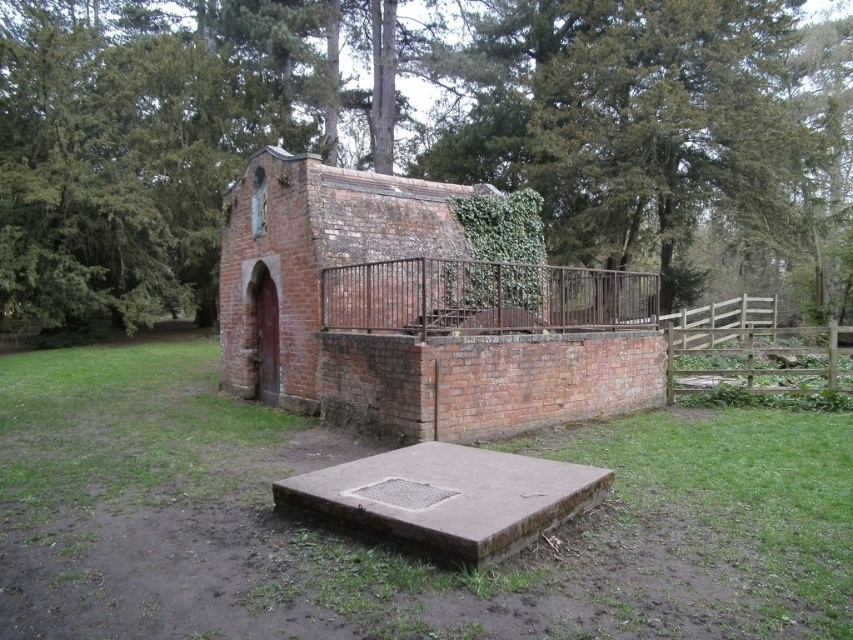
Can you confirm if green leafy tree at upper center is positioned above wooden gate at right?

Correct, green leafy tree at upper center is located above wooden gate at right.

Who is shorter, green leafy tree at upper center or wooden gate at right?

wooden gate at right

This screenshot has height=640, width=853. Identify the location of green leafy tree at upper center. (418, 134).

Can you confirm if brick chapel at center is wider than wooden gate at right?

Incorrect, brick chapel at center's width does not surpass wooden gate at right's.

Looking at this image, who is positioned more to the right, brick chapel at center or wooden gate at right?

wooden gate at right is more to the right.

Is point (306, 177) closer to camera compared to point (703, 323)?

Yes, point (306, 177) is closer to viewer.

Where is `brick chapel at center`? This screenshot has width=853, height=640. brick chapel at center is located at coordinates (416, 310).

Is the position of rusty metal fence at center less distant than that of wooden gate at right?

That is True.

Does rusty metal fence at center have a smaller size compared to wooden gate at right?

Yes, rusty metal fence at center is smaller than wooden gate at right.

Which is behind, point (367, 264) or point (715, 332)?

Point (715, 332)

The width and height of the screenshot is (853, 640). I want to click on rusty metal fence at center, so click(483, 296).